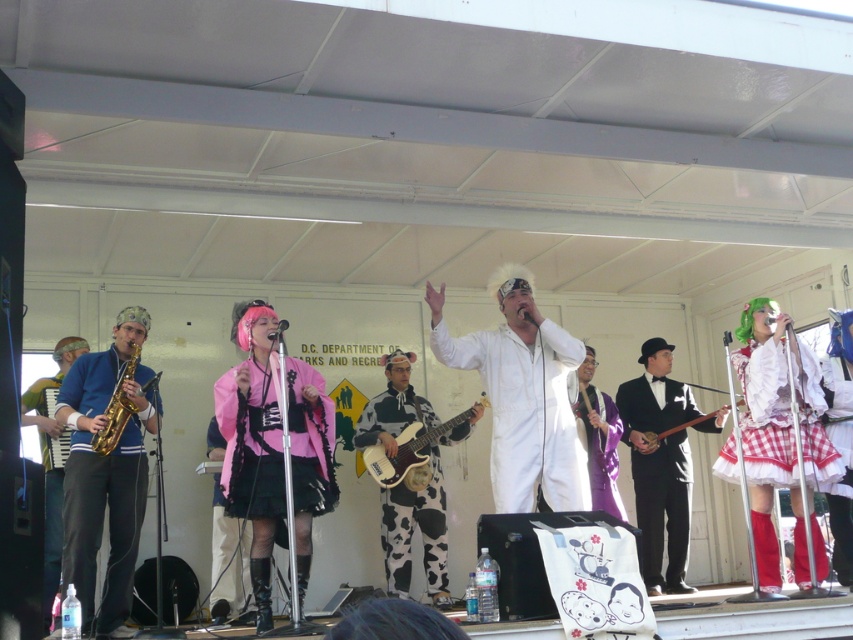
Where is the matte pink fabric at center located in the image?

The matte pink fabric at center is located at point (250, 444).

You are standing 6 meters away from the stage. Is the point at coordinate point (x=729, y=472) closer or farther than your current position?

The distance of point (x=729, y=472) from viewer is 5.99 meters, so it is closer than your current position which is 6 meters away.

You are a photographer at the back of the stage. You want to capture a photo of the white gingham dress at right and the cow print fabric guitar at center. Which object should you zoom in on to make it appear larger in your photo?

The cow print fabric guitar at center is taller than the white gingham dress at right, so you should zoom in on the cow print fabric guitar at center to make it appear larger in your photo.